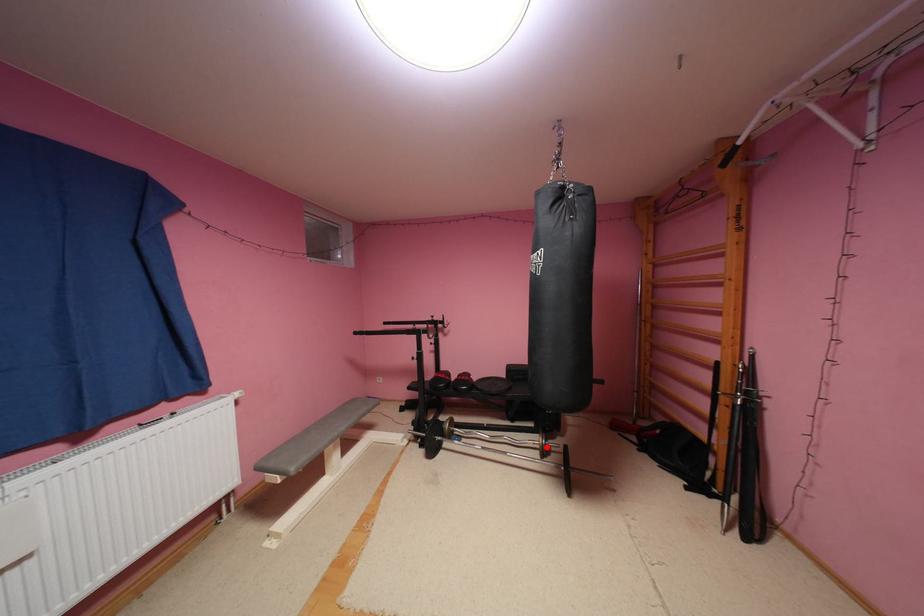
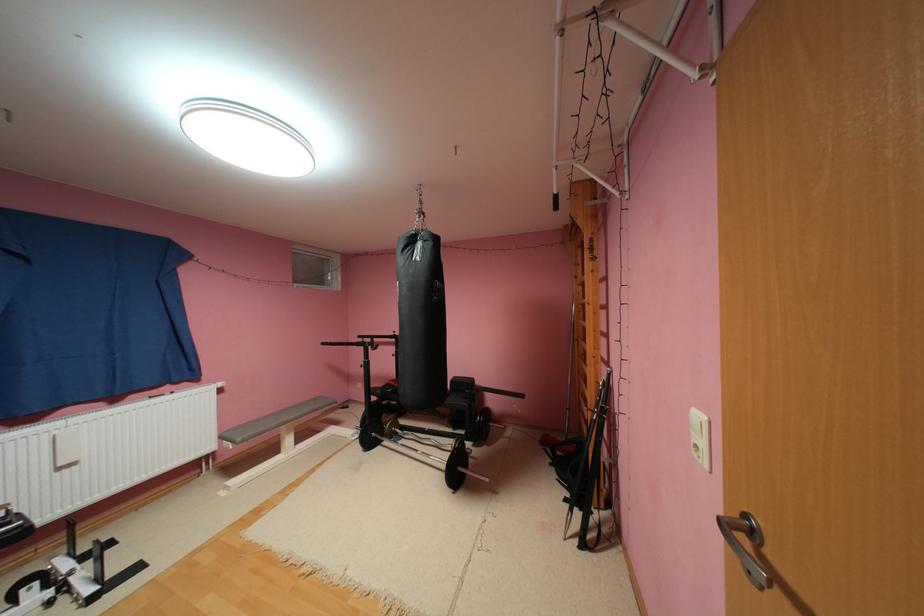
Question: I am providing you with two images of the same scene from different viewpoints. Given a red point in image1, look at the same physical point in image2. Is it:

Choices:
 (A) Closer to the viewpoint
 (B) Farther from the viewpoint

Answer: (A)